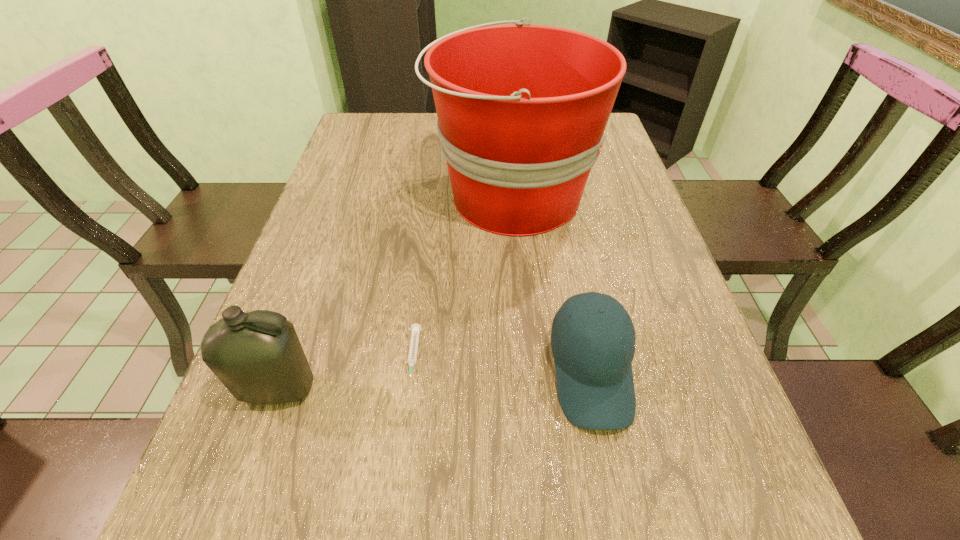
Where is `object present at the left edge`? object present at the left edge is located at coordinates (258, 357).

Where is `bucket that is at the right edge`? The height and width of the screenshot is (540, 960). bucket that is at the right edge is located at coordinates 522,109.

Identify the location of baseball cap positioned at the right edge. (594, 376).

Where is `vacant area at the left edge of the desktop`? This screenshot has width=960, height=540. vacant area at the left edge of the desktop is located at coordinates (383, 164).

This screenshot has width=960, height=540. Find the location of `vacant region at the right edge of the desktop`. vacant region at the right edge of the desktop is located at coordinates (664, 250).

The image size is (960, 540). In order to click on vacant space at the far left corner of the desktop in this screenshot , I will do `click(376, 131)`.

Where is `vacant area that lies between the shortest object and the baseball cap`? The height and width of the screenshot is (540, 960). vacant area that lies between the shortest object and the baseball cap is located at coordinates (502, 364).

Locate an element on the screen. This screenshot has height=540, width=960. free space between the shortest object and the bottle is located at coordinates (346, 373).

This screenshot has height=540, width=960. In order to click on vacant area that lies between the shortest object and the second shortest object in this screenshot , I will do `click(502, 364)`.

At what (x,y) coordinates should I click in order to perform the action: click on empty location between the baseball cap and the tallest object. Please return your answer as a coordinate pair (x, y). The image size is (960, 540). Looking at the image, I should click on (551, 285).